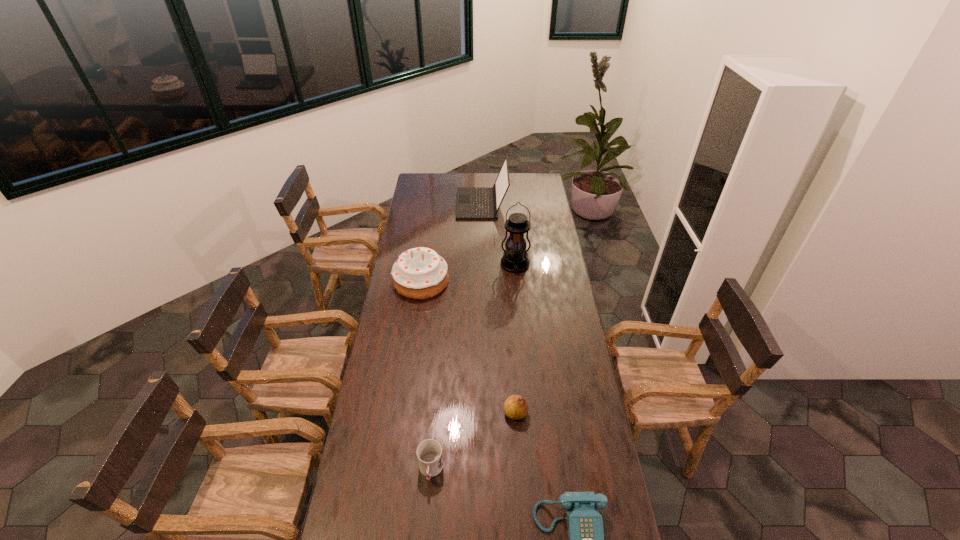
The height and width of the screenshot is (540, 960). I want to click on the tallest object, so click(x=515, y=259).

At what (x,y) coordinates should I click in order to perform the action: click on the farthest object. Please return your answer as a coordinate pair (x, y). This screenshot has height=540, width=960. Looking at the image, I should click on (473, 203).

Where is `the second tallest object`? The width and height of the screenshot is (960, 540). the second tallest object is located at coordinates (473, 203).

Image resolution: width=960 pixels, height=540 pixels. I want to click on cake, so click(420, 273).

I want to click on the fourth farthest object, so click(x=515, y=407).

Image resolution: width=960 pixels, height=540 pixels. Identify the location of pear. (515, 407).

You are a GUI agent. You are given a task and a screenshot of the screen. Output one action in this format:
    pyautogui.click(x=<x>, y=<y>)
    Task: Click on the cup
    This screenshot has width=960, height=540.
    Given the screenshot: What is the action you would take?
    pyautogui.click(x=429, y=452)

Can you point to a free location located above the lantern, indicating its light source? Please provide its 2D coordinates. Your answer should be formatted as a tuple, i.e. [(x, y)], where the tuple contains the x and y coordinates of a point satisfying the conditions above.

[(520, 328)]

Find the location of a particular element. The image size is (960, 540). vacant space located on the surface of the laptop is located at coordinates (416, 204).

What are the coordinates of `free location located 0.050m on the surface of the laptop` in the screenshot? It's located at (x=448, y=204).